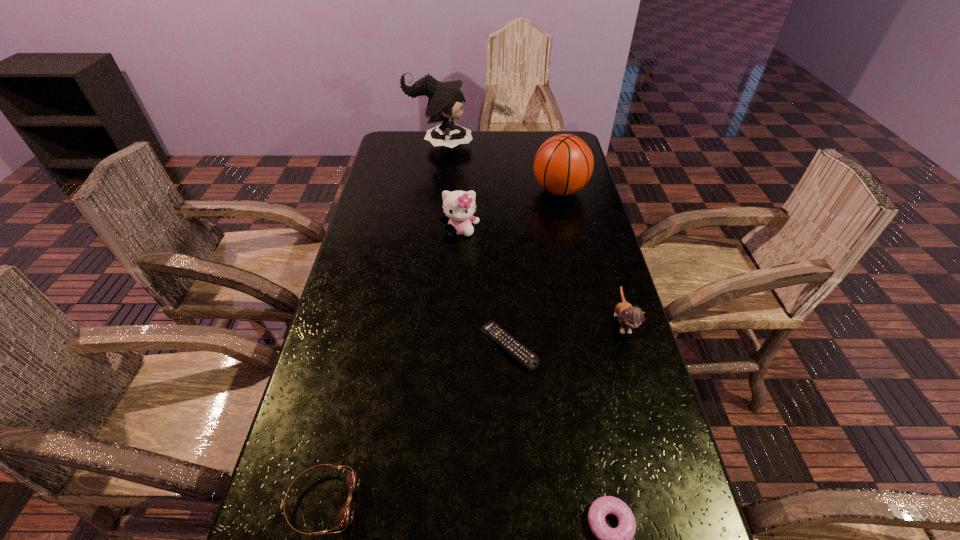
Find the location of a particular element. the fourth object from right to left is located at coordinates 528,359.

Identify the location of free location located at the face of the doll. Image resolution: width=960 pixels, height=540 pixels. (486, 146).

Image resolution: width=960 pixels, height=540 pixels. Identify the location of free space located 0.320m on the front of the sixth shortest object. (579, 275).

At what (x,y) coordinates should I click in order to perform the action: click on vacant space located 0.100m on the front-facing side of the left kitten. Please return your answer as a coordinate pair (x, y). Looking at the image, I should click on (459, 261).

You are a GUI agent. You are given a task and a screenshot of the screen. Output one action in this format:
    pyautogui.click(x=<x>, y=<y>)
    Task: Click on the free space located 0.230m on the front-facing side of the shorter kitten
    Image resolution: width=960 pixels, height=540 pixels.
    Given the screenshot: What is the action you would take?
    pyautogui.click(x=656, y=437)

Where is `blank area located 0.060m through the lenses of the fifth tallest object`? This screenshot has height=540, width=960. blank area located 0.060m through the lenses of the fifth tallest object is located at coordinates (389, 502).

Where is `vacant region located 0.220m on the right of the fourth object from right to left`? The image size is (960, 540). vacant region located 0.220m on the right of the fourth object from right to left is located at coordinates (628, 347).

Where is `object that is positioned at the far edge`? This screenshot has width=960, height=540. object that is positioned at the far edge is located at coordinates (445, 101).

At what (x,y) coordinates should I click in order to perform the action: click on doll situated at the left edge. Please return your answer as a coordinate pair (x, y). This screenshot has height=540, width=960. Looking at the image, I should click on (445, 101).

You are a GUI agent. You are given a task and a screenshot of the screen. Output one action in this format:
    pyautogui.click(x=<x>, y=<y>)
    Task: Click on the goggles at the left edge
    Image resolution: width=960 pixels, height=540 pixels.
    Given the screenshot: What is the action you would take?
    pyautogui.click(x=344, y=517)